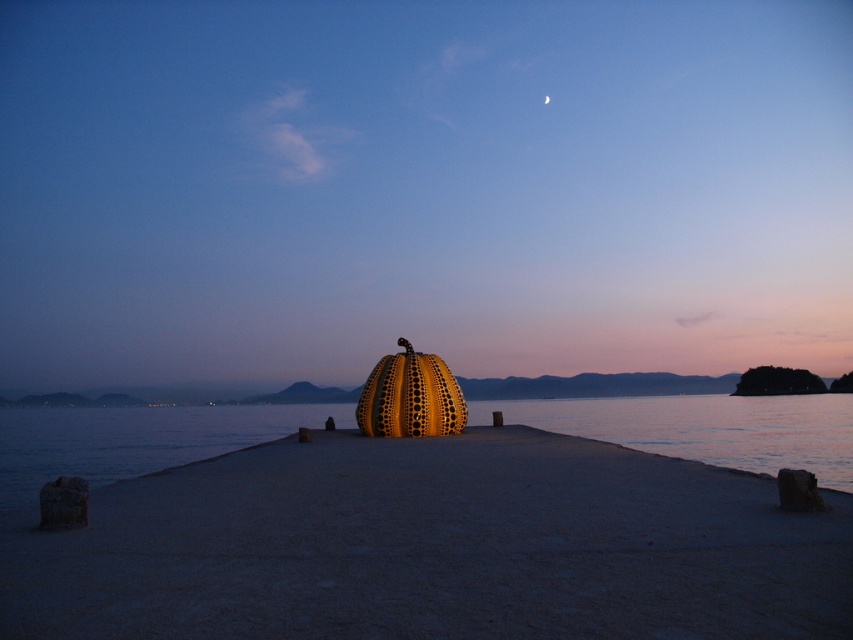
Question: Is smooth concrete dock at center positioned at the back of silver metallic crescent moon at upper center?

Choices:
 (A) no
 (B) yes

Answer: (A)

Question: Can you confirm if smooth concrete dock at center is wider than silver metallic crescent moon at upper center?

Choices:
 (A) no
 (B) yes

Answer: (B)

Question: Is the position of smooth concrete dock at center less distant than that of silver metallic crescent moon at upper center?

Choices:
 (A) no
 (B) yes

Answer: (B)

Question: Among these points, which one is nearest to the camera?

Choices:
 (A) (77, 593)
 (B) (544, 99)
 (C) (776, 413)

Answer: (A)

Question: Considering the real-world distances, which object is farthest from the transparent water at center?

Choices:
 (A) smooth concrete dock at center
 (B) silver metallic crescent moon at upper center

Answer: (B)

Question: Among these objects, which one is farthest from the camera?

Choices:
 (A) transparent water at center
 (B) silver metallic crescent moon at upper center

Answer: (B)